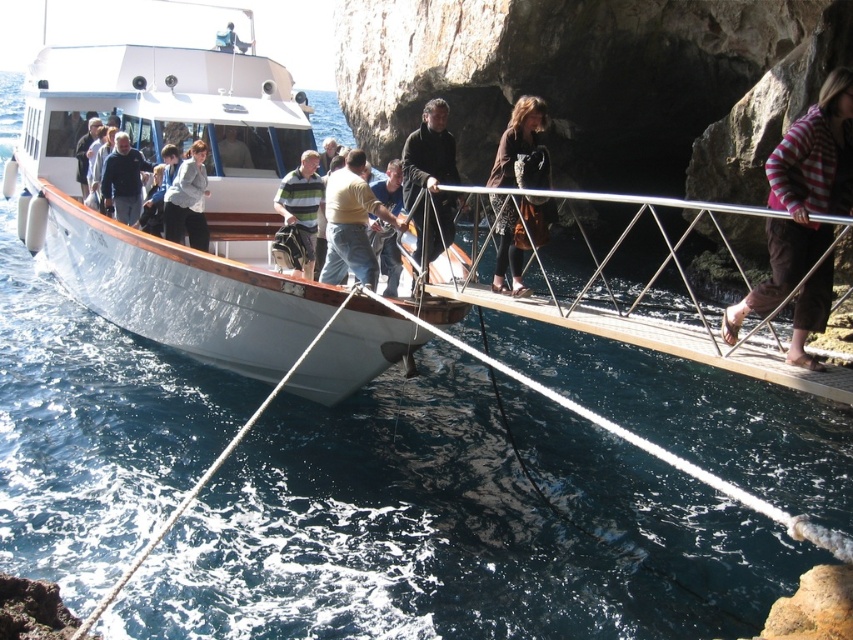
Between point (55, 189) and point (740, 301), which one is positioned behind?

Point (740, 301)

Measure the distance between point (177, 326) and camera.

Point (177, 326) is 15.46 meters from camera.

Where is `white polished wood boat at center`? Image resolution: width=853 pixels, height=640 pixels. white polished wood boat at center is located at coordinates (200, 209).

Can you confirm if light brown denim jeans at center is smaller than brown leather jacket at center?

Yes, light brown denim jeans at center is smaller than brown leather jacket at center.

Which is more to the right, light brown denim jeans at center or brown leather jacket at center?

Positioned to the right is brown leather jacket at center.

Find the location of a particular element. light brown denim jeans at center is located at coordinates (351, 224).

The image size is (853, 640). I want to click on light brown denim jeans at center, so click(x=351, y=224).

Is striped sweater at right taller than light brown denim jeans at center?

No, striped sweater at right is not taller than light brown denim jeans at center.

Between striped sweater at right and light brown denim jeans at center, which one appears on the left side from the viewer's perspective?

From the viewer's perspective, light brown denim jeans at center appears more on the left side.

Is point (772, 296) closer to camera compared to point (335, 195)?

Yes.

Locate an element on the screen. This screenshot has width=853, height=640. striped sweater at right is located at coordinates 802,196.